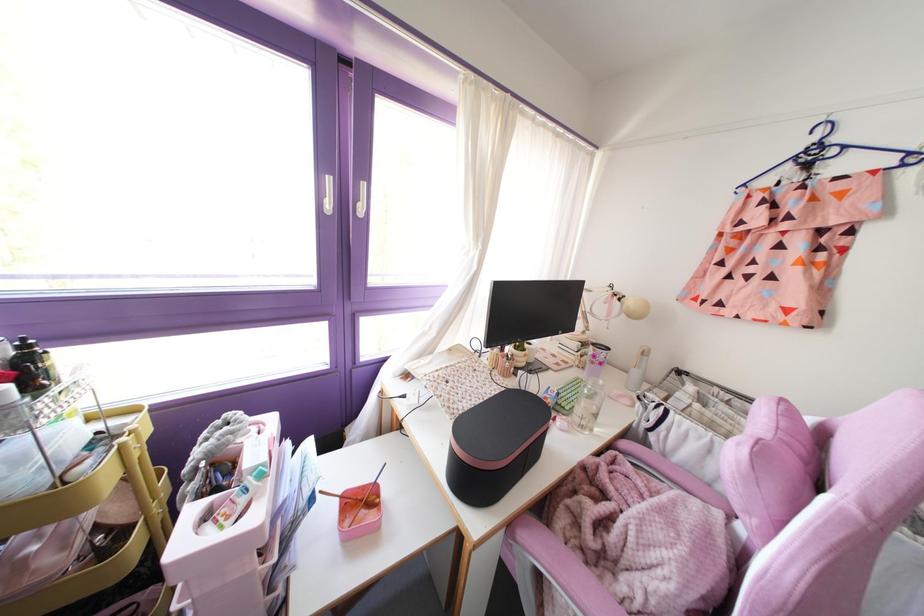
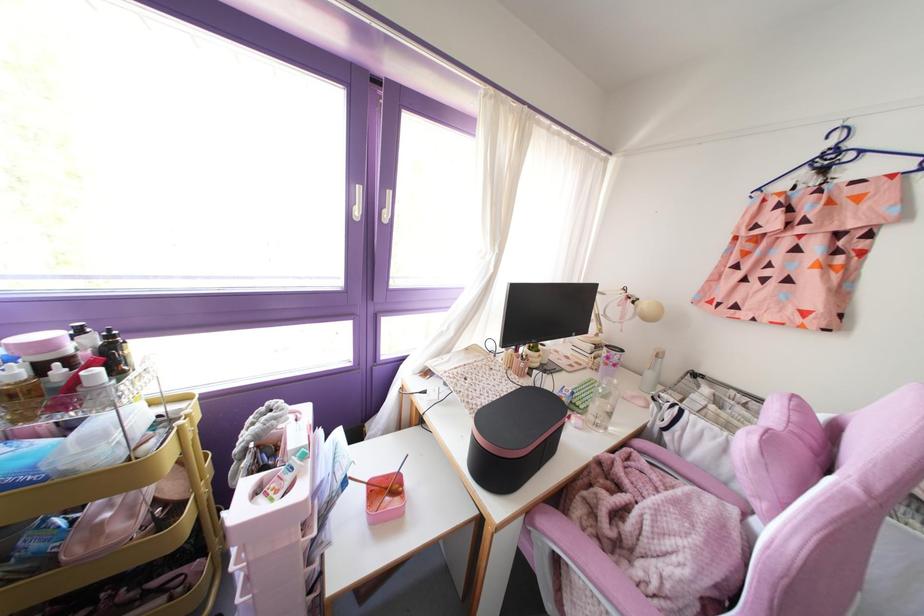
Find the pixel in the second image that matches [581,282] in the first image.

(594, 285)